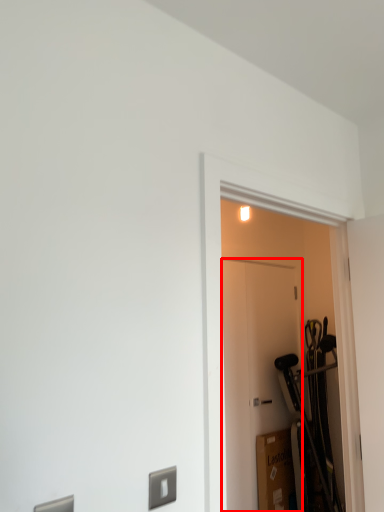
Question: Observing the image, what is the correct spatial positioning of door (annotated by the red box) in reference to door?

Choices:
 (A) right
 (B) left

Answer: (A)